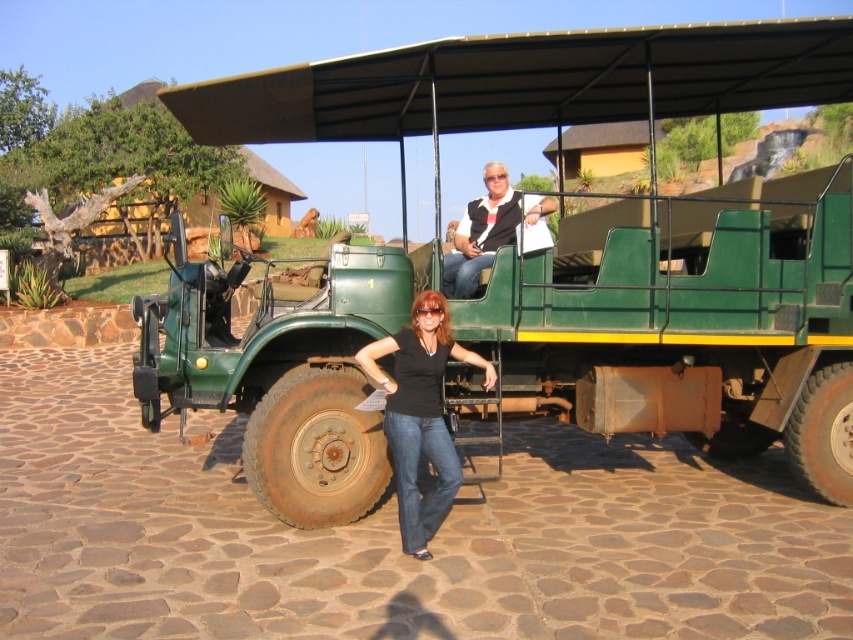
Between rusty metal truck at center and brown rubber tire at lower right, which one is positioned higher?

rusty metal truck at center

Who is more forward, (x=352, y=426) or (x=735, y=442)?

Point (x=352, y=426) is in front.

Which is behind, point (281, 512) or point (747, 438)?

Point (747, 438)

This screenshot has width=853, height=640. In order to click on rusty metal truck at center in this screenshot , I will do `click(676, 307)`.

Identify the location of rusty metal tire at lower right. (822, 433).

Between rusty metal tire at lower right and brown rubber tire at lower right, which one appears on the left side from the viewer's perspective?

Positioned to the left is brown rubber tire at lower right.

Which is behind, point (825, 388) or point (722, 452)?

Positioned behind is point (722, 452).

Identify the location of rusty metal tire at lower right. Image resolution: width=853 pixels, height=640 pixels. (822, 433).

Which is below, rusty metal truck at center or rusty metal tire at lower right?

rusty metal tire at lower right is lower down.

Does point (372, 465) lie in front of point (830, 435)?

That is True.

Does point (184, 371) come closer to viewer compared to point (796, 449)?

Yes, it is in front of point (796, 449).

This screenshot has width=853, height=640. In order to click on rusty metal truck at center in this screenshot , I will do `click(676, 307)`.